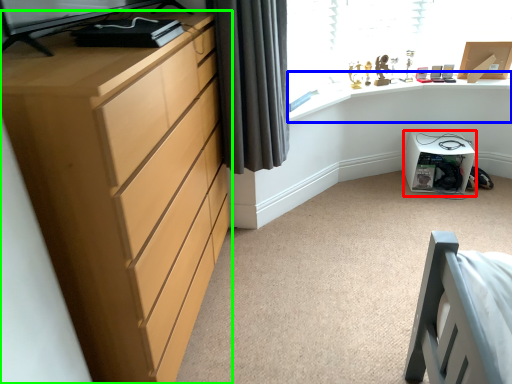
Question: Based on their relative distances, which object is nearer to cabinetry (highlighted by a red box)? Choose from computer desk (highlighted by a blue box) and chest of drawers (highlighted by a green box).

Choices:
 (A) computer desk
 (B) chest of drawers

Answer: (A)